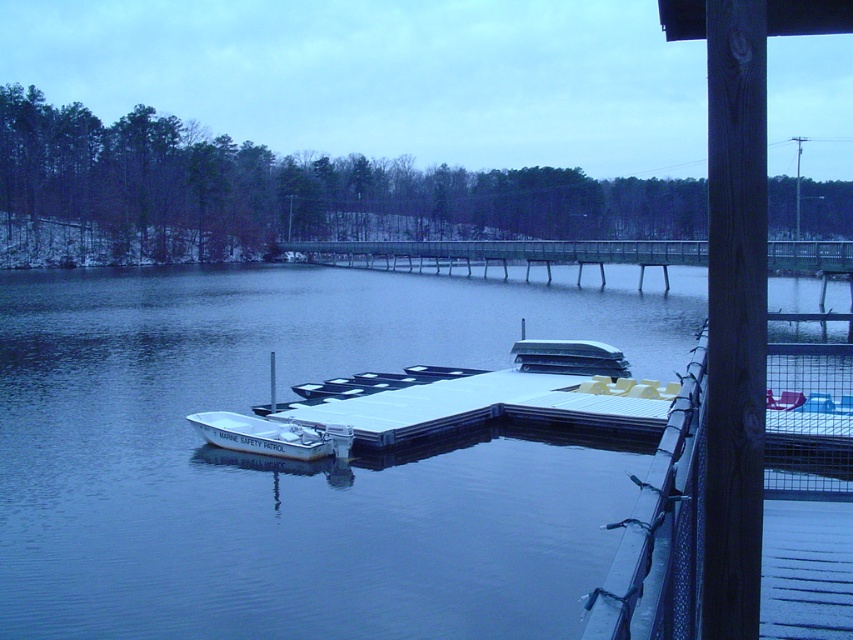
Does blue water at center appear under white matte boat at lower left?

No, blue water at center is not below white matte boat at lower left.

Does blue water at center have a larger size compared to white matte boat at lower left?

Yes, blue water at center is bigger than white matte boat at lower left.

Is point (437, 474) positioned before point (194, 420)?

Yes, it is.

Image resolution: width=853 pixels, height=640 pixels. In order to click on blue water at center in this screenshot , I will do `click(296, 461)`.